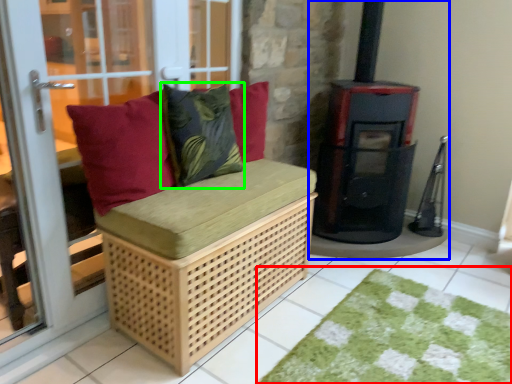
Question: Considering the real-world distances, which object is farthest from doormat (highlighted by a red box)? wood burning stove (highlighted by a blue box) or throw pillow (highlighted by a green box)?

Choices:
 (A) wood burning stove
 (B) throw pillow

Answer: (B)